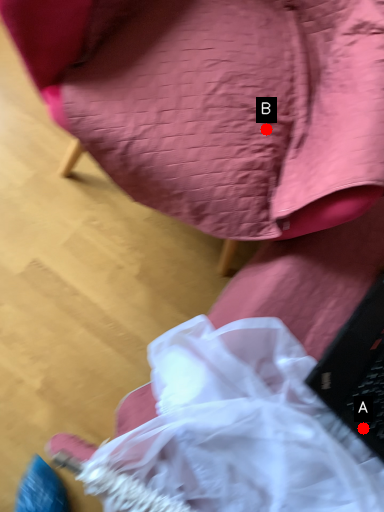
Question: Two points are circled on the image, labeled by A and B beside each circle. Which point is farther to the camera?

Choices:
 (A) A is further
 (B) B is further

Answer: (B)